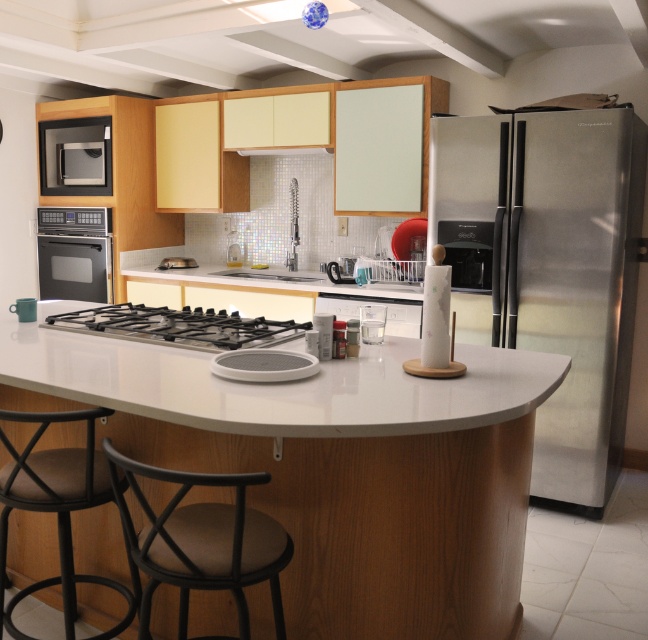
Question: Is satin silver microwave at upper left bigger than white glossy sink at center?

Choices:
 (A) no
 (B) yes

Answer: (B)

Question: Which point is closer to the camera?

Choices:
 (A) satin silver microwave at upper left
 (B) black metal bar stool at lower left

Answer: (B)

Question: Which of the following is the closest to the observer?

Choices:
 (A) (75, 378)
 (B) (253, 568)
 (C) (43, 168)
 (D) (145, 317)

Answer: (B)

Question: Is stainless steel refrigerator at right thinner than white glossy countertop at center?

Choices:
 (A) no
 (B) yes

Answer: (B)

Question: Is black metal bar stool at lower left wider than satin black oven at left?

Choices:
 (A) no
 (B) yes

Answer: (A)

Question: Estimate the real-world distances between objects in this image. Which object is farther from the satin silver microwave at upper left?

Choices:
 (A) white glossy counter top at center
 (B) white glossy countertop at center

Answer: (A)